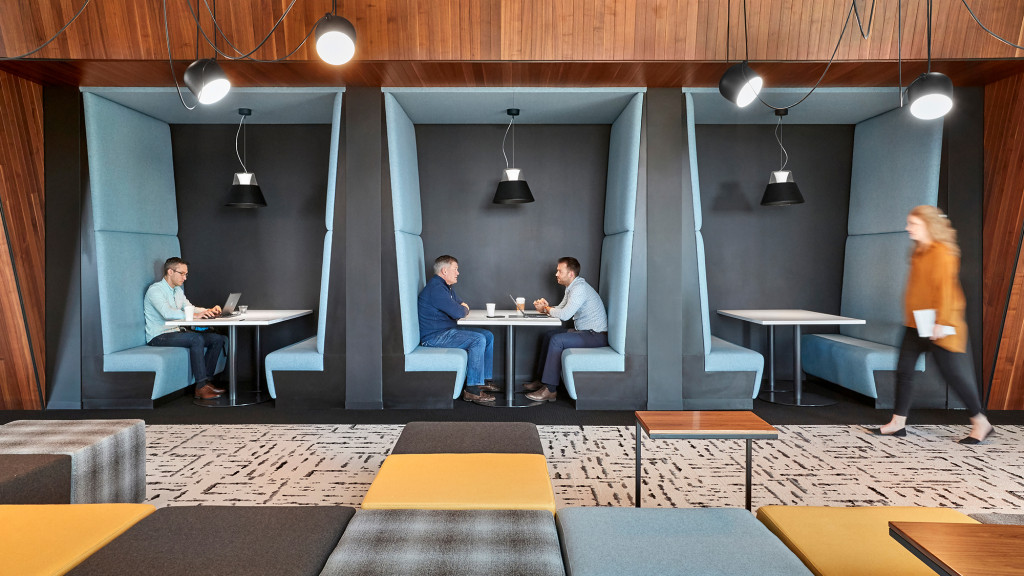
Where is `paneling`? The width and height of the screenshot is (1024, 576). paneling is located at coordinates (16, 200).